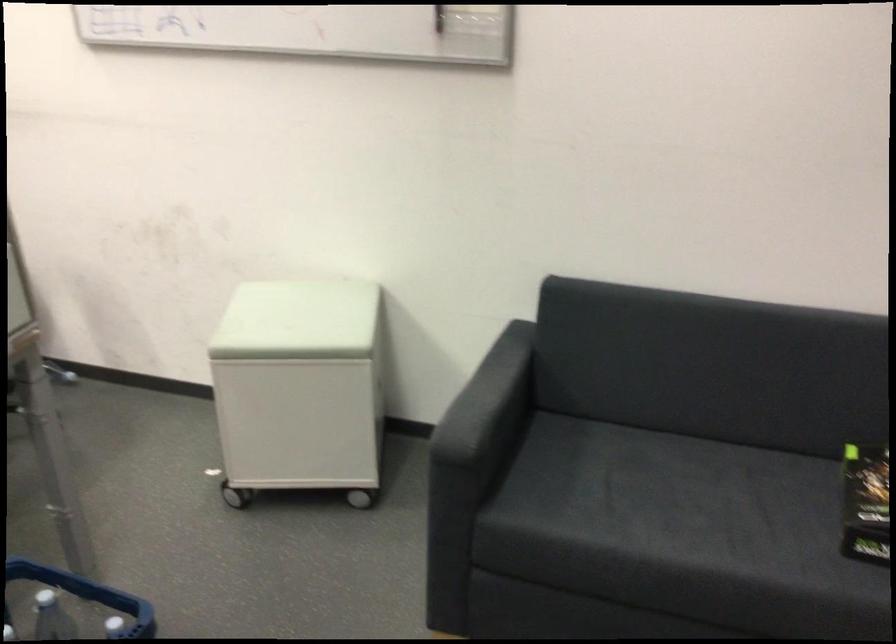
The width and height of the screenshot is (896, 644). What do you see at coordinates (297, 321) in the screenshot?
I see `the cabinet cushioned lid` at bounding box center [297, 321].